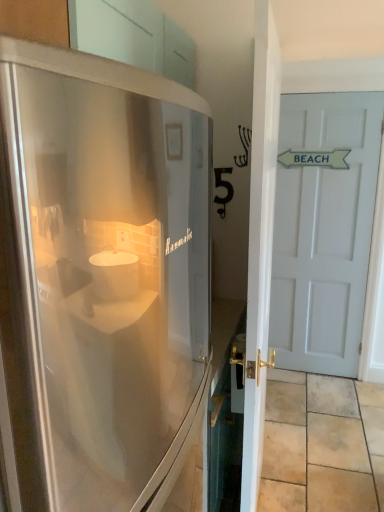
Measure the distance between point (183, 199) and camera.

Point (183, 199) and camera are 8.00 feet apart from each other.

The width and height of the screenshot is (384, 512). What do you see at coordinates (260, 242) in the screenshot?
I see `white glossy door at right, the first door positioned from the left` at bounding box center [260, 242].

You are a GUI agent. You are given a task and a screenshot of the screen. Output one action in this format:
    pyautogui.click(x=<x>, y=<y>)
    Task: Click on the white matte door at right, which is the 2th door in left-to-right order
    
    Given the screenshot: What is the action you would take?
    pyautogui.click(x=323, y=228)

What are the coordinates of `beige stone tile at lower right` in the screenshot? It's located at (322, 444).

The height and width of the screenshot is (512, 384). What do you see at coordinates (322, 444) in the screenshot?
I see `beige stone tile at lower right` at bounding box center [322, 444].

Image resolution: width=384 pixels, height=512 pixels. In order to click on stainless steel refrigerator at left in this screenshot , I will do `click(104, 277)`.

In the scene shown: Which object is closer to the camera, beige stone tile at lower right or white matte door at right, the first door from the back?

Positioned in front is beige stone tile at lower right.

Which of these two, beige stone tile at lower right or white matte door at right, which ranks as the 1th door in right-to-left order, is bigger?

white matte door at right, which ranks as the 1th door in right-to-left order, is bigger.

The image size is (384, 512). I want to click on tile lying in front of the white matte door at right, the first door from the back, so click(x=322, y=444).

Which object is positioned more to the left, white glossy door at right, which appears as the second door when viewed from the right, or white matte door at right, marked as the second door in a front-to-back arrangement?

Positioned to the left is white glossy door at right, which appears as the second door when viewed from the right.

Can you confirm if white glossy door at right, the first door when ordered from front to back, is bigger than white matte door at right, the first door from the back?

Yes.

Where is `door on the left of white matte door at right, which ranks as the 1th door in right-to-left order`? The image size is (384, 512). door on the left of white matte door at right, which ranks as the 1th door in right-to-left order is located at coordinates (260, 242).

Considering the positions of objects white matte door at right, the first door from the back, and white glossy door at right, which appears as the second door when viewed from the right, in the image provided, who is more to the left, white matte door at right, the first door from the back, or white glossy door at right, which appears as the second door when viewed from the right,?

white glossy door at right, which appears as the second door when viewed from the right, is more to the left.

Does white matte door at right, which ranks as the 1th door in right-to-left order, lie behind white glossy door at right, which appears as the second door when viewed from the right?

Yes.

Is white matte door at right, marked as the second door in a front-to-back arrangement, not close to white glossy door at right, the first door when ordered from front to back?

white matte door at right, marked as the second door in a front-to-back arrangement, is far away from white glossy door at right, the first door when ordered from front to back.

Is the position of beige stone tile at lower right less distant than that of white glossy door at right, which is the 2th door from back to front?

No, beige stone tile at lower right is further to the viewer.

From the image's perspective, starting from the beige stone tile at lower right, which door is the 1st one above? Please provide its 2D coordinates.

[(260, 242)]

Between beige stone tile at lower right and white glossy door at right, which is the 2th door from back to front, which one has larger size?

With larger size is white glossy door at right, which is the 2th door from back to front.

Looking at their sizes, would you say beige stone tile at lower right is wider or thinner than white glossy door at right, the first door when ordered from front to back?

Considering their sizes, beige stone tile at lower right looks broader than white glossy door at right, the first door when ordered from front to back.

Considering the relative positions of stainless steel refrigerator at left and white matte door at right, marked as the second door in a front-to-back arrangement, in the image provided, is stainless steel refrigerator at left to the left or to the right of white matte door at right, marked as the second door in a front-to-back arrangement,?

stainless steel refrigerator at left is positioned on white matte door at right, marked as the second door in a front-to-back arrangement,'s left side.

Does stainless steel refrigerator at left have a smaller size compared to white matte door at right, which is the 2th door in left-to-right order?

Actually, stainless steel refrigerator at left might be larger than white matte door at right, which is the 2th door in left-to-right order.

From a real-world perspective, is stainless steel refrigerator at left on white matte door at right, marked as the second door in a front-to-back arrangement?

Yes.

Which is more to the left, white matte door at right, which ranks as the 1th door in right-to-left order, or beige stone tile at lower right?

beige stone tile at lower right.

Would you consider white matte door at right, marked as the second door in a front-to-back arrangement, to be distant from beige stone tile at lower right?

white matte door at right, marked as the second door in a front-to-back arrangement, is near beige stone tile at lower right, not far away.

From a real-world perspective, is white matte door at right, which is the 2th door in left-to-right order, physically below beige stone tile at lower right?

No, from a real-world perspective, white matte door at right, which is the 2th door in left-to-right order, is not beneath beige stone tile at lower right.

From the image's perspective, is white matte door at right, marked as the second door in a front-to-back arrangement, above or below beige stone tile at lower right?

From the image's perspective, white matte door at right, marked as the second door in a front-to-back arrangement, appears above beige stone tile at lower right.

Is white glossy door at right, which appears as the second door when viewed from the right, next to stainless steel refrigerator at left?

No, white glossy door at right, which appears as the second door when viewed from the right, is not next to stainless steel refrigerator at left.

Find the location of a particular element. refrigerator in front of the white glossy door at right, the first door positioned from the left is located at coordinates pos(104,277).

Is point (277, 146) less distant than point (52, 499)?

No, (277, 146) is further to viewer.

From the image's perspective, which is below, white glossy door at right, the first door when ordered from front to back, or stainless steel refrigerator at left?

From the image's view, stainless steel refrigerator at left is below.

I want to click on tile on the left of white matte door at right, the first door from the back, so click(322, 444).

Identify the location of door lying in front of the white matte door at right, marked as the second door in a front-to-back arrangement. (260, 242).

Based on their spatial positions, is white matte door at right, the first door from the back, or beige stone tile at lower right further from stainless steel refrigerator at left?

white matte door at right, the first door from the back, is further to stainless steel refrigerator at left.

Which object lies further to the anchor point white glossy door at right, which is the 2th door from back to front, beige stone tile at lower right or white matte door at right, which ranks as the 1th door in right-to-left order?

white matte door at right, which ranks as the 1th door in right-to-left order, lies further to white glossy door at right, which is the 2th door from back to front, than the other object.

Considering their positions, is stainless steel refrigerator at left positioned further to white matte door at right, the first door from the back, than beige stone tile at lower right?

stainless steel refrigerator at left is positioned further to the anchor white matte door at right, the first door from the back.

Which object lies further to the anchor point beige stone tile at lower right, white glossy door at right, which is the 2th door from back to front, or stainless steel refrigerator at left?

Based on the image, stainless steel refrigerator at left appears to be further to beige stone tile at lower right.

Looking at the image, which one is located closer to white glossy door at right, which appears as the second door when viewed from the right, white matte door at right, which ranks as the 1th door in right-to-left order, or stainless steel refrigerator at left?

stainless steel refrigerator at left is closer to white glossy door at right, which appears as the second door when viewed from the right.

When comparing their distances from beige stone tile at lower right, does stainless steel refrigerator at left or white glossy door at right, the first door positioned from the left, seem further?

Based on the image, stainless steel refrigerator at left appears to be further to beige stone tile at lower right.

Considering their positions, is white glossy door at right, the first door positioned from the left, positioned further to white matte door at right, the first door from the back, than stainless steel refrigerator at left?

Based on the image, white glossy door at right, the first door positioned from the left, appears to be further to white matte door at right, the first door from the back.

When comparing their distances from stainless steel refrigerator at left, does beige stone tile at lower right or white glossy door at right, which is the 2th door from back to front, seem further?

Among the two, beige stone tile at lower right is located further to stainless steel refrigerator at left.

At what (x,y) coordinates should I click in order to perform the action: click on door located between stainless steel refrigerator at left and white matte door at right, which is the 2th door in left-to-right order, in the depth direction. Please return your answer as a coordinate pair (x, y). Looking at the image, I should click on (260, 242).

At what (x,y) coordinates should I click in order to perform the action: click on tile between stainless steel refrigerator at left and white matte door at right, which is the 2th door in left-to-right order, in the front-back direction. Please return your answer as a coordinate pair (x, y). The height and width of the screenshot is (512, 384). Looking at the image, I should click on (322, 444).

Where is `door positioned between stainless steel refrigerator at left and beige stone tile at lower right from near to far`? door positioned between stainless steel refrigerator at left and beige stone tile at lower right from near to far is located at coordinates (260, 242).

Locate an element on the screen. This screenshot has width=384, height=512. tile between white glossy door at right, which appears as the second door when viewed from the right, and white matte door at right, the first door from the back, along the z-axis is located at coordinates (322, 444).